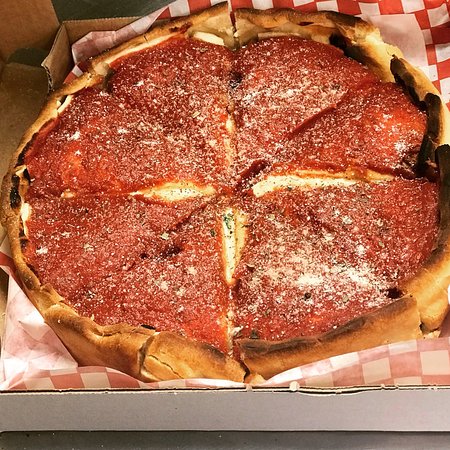
Identify the location of table. The width and height of the screenshot is (450, 450). (211, 444), (104, 6).